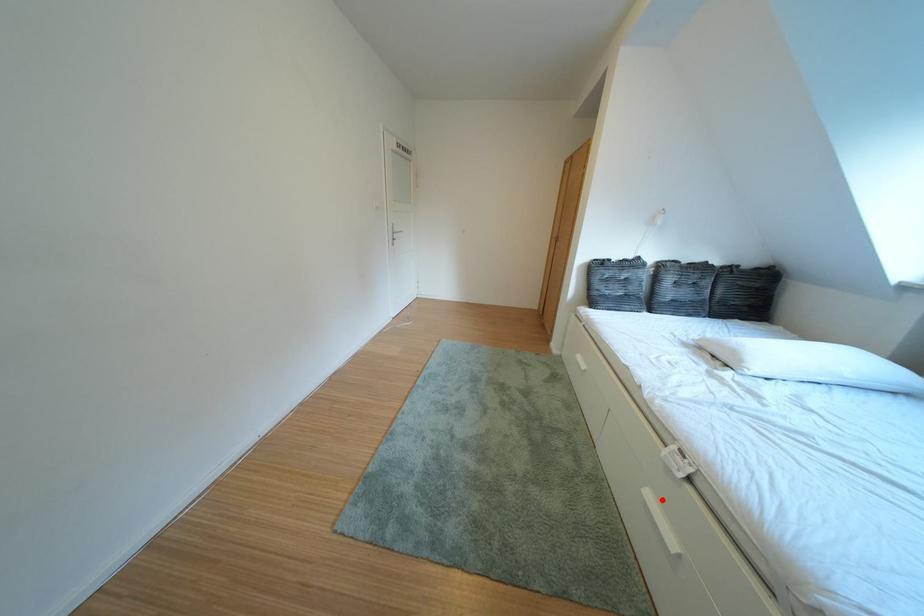
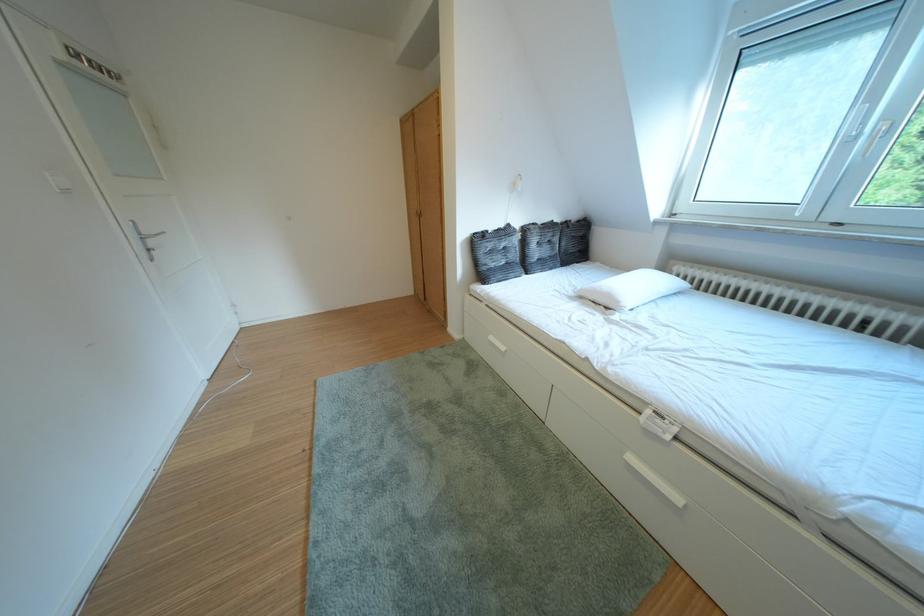
Where in the second image is the point corresponding to the highlighted location from the first image?

(646, 464)